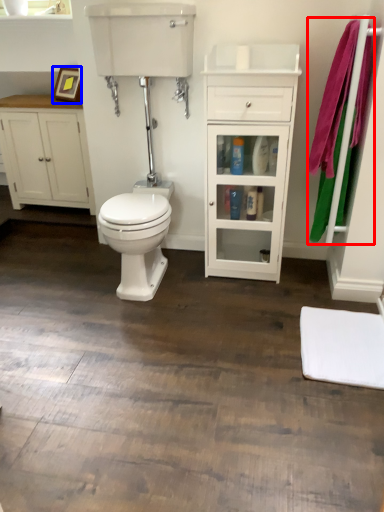
Question: Which object is further to the camera taking this photo, bath towel (highlighted by a red box) or picture frame (highlighted by a blue box)?

Choices:
 (A) bath towel
 (B) picture frame

Answer: (B)